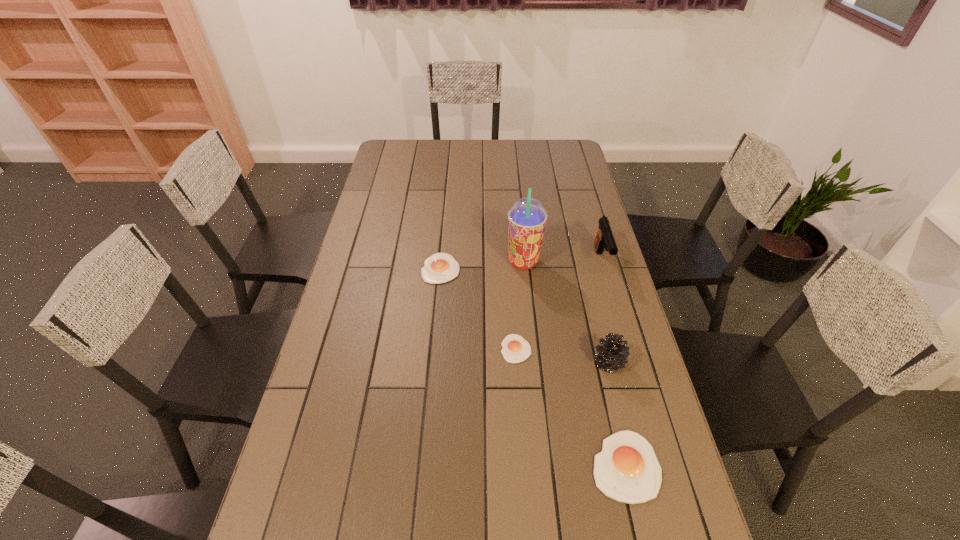
Identify the location of vacant area that lies between the pinecone and the nearest egg yolk. (617, 414).

Where is `empty space between the smoothie and the fourth shortest object`? empty space between the smoothie and the fourth shortest object is located at coordinates (566, 313).

Image resolution: width=960 pixels, height=540 pixels. I want to click on empty space that is in between the pistol and the pinecone, so click(605, 312).

Locate an element on the screen. This screenshot has width=960, height=540. empty space that is in between the rightmost egg yolk and the second farthest egg yolk is located at coordinates (571, 407).

The image size is (960, 540). What are the coordinates of `vacant area that lies between the tallest object and the nearest egg yolk` in the screenshot? It's located at (574, 364).

Select which object is the third closest to the pinecone. Please provide its 2D coordinates. Your answer should be formatted as a tuple, i.e. [(x, y)], where the tuple contains the x and y coordinates of a point satisfying the conditions above.

[(604, 238)]

Identify the location of object that is the closest to the second egg yolk from left to right. (613, 353).

Find the location of `egg yolk that is the closest to the second nearest egg yolk`. egg yolk that is the closest to the second nearest egg yolk is located at coordinates (627, 470).

The image size is (960, 540). Identify the location of the second closest egg yolk to the leftmost egg yolk. (627, 470).

At what (x,y) coordinates should I click in order to perform the action: click on blank area in the image that satisfies the following two spatial constraints: 1. on the back side of the rightmost egg yolk; 2. on the left side of the pinecone. Please return your answer as a coordinate pair (x, y). Looking at the image, I should click on (602, 363).